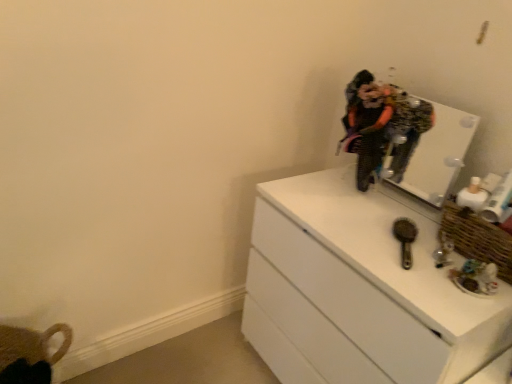
Where is `free point behind metallic brown brush at center-right`? The height and width of the screenshot is (384, 512). free point behind metallic brown brush at center-right is located at coordinates (382, 219).